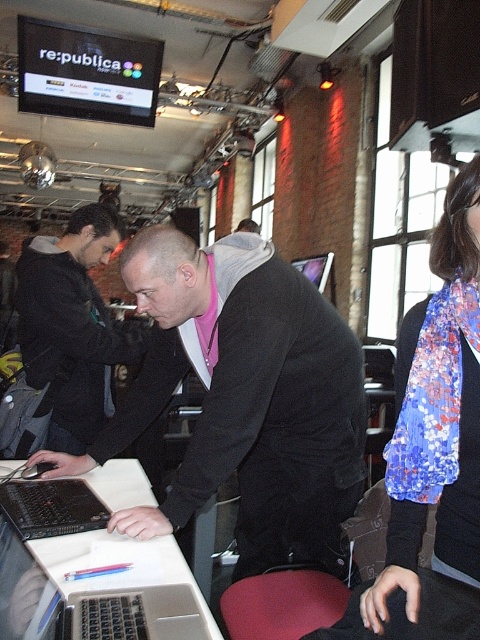
You are organizing a tech conference and need to adjust the seating arrangement. You have a matte black jacket at center and a black matte keyboard at center on the table. To make space for a presentation remote, where should you move the keyboard relative to the jacket?

The black matte keyboard at center is currently behind the matte black jacket at center. To make space for the presentation remote, you should move the keyboard forward so it is in front of the matte black jacket at center.

Based on the photo, you are a photographer setting up for an event. You need to place a 12 inch wide camera on the table between the matte black jacket at center and the black matte keyboard at center. Is there enough space between them to fit the camera?

The matte black jacket at center and black matte keyboard at center are 13.61 inches apart. Since the camera is 12 inches wide, there is enough space between them to fit the camera.

You are organizing a tech conference and need to set up a demo station. You have a dark gray hoodie at center and a black matte keyboard at center. Which object should you move to ensure the keyboard is accessible for the presenter?

A: The dark gray hoodie at center is positioned over the black matte keyboard at center, so you should move the dark gray hoodie at center to make the keyboard accessible.